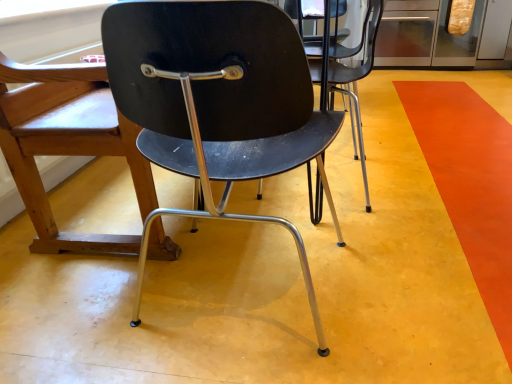
Question: Is orange matte floor at lower right situated inside matte black chair at center, which is the 1th chair in back-to-front order, or outside?

Choices:
 (A) outside
 (B) inside

Answer: (A)

Question: In the image, is orange matte floor at lower right positioned in front of or behind matte black chair at center, the 2th chair when ordered from front to back?

Choices:
 (A) front
 (B) behind

Answer: (A)

Question: Which object is the farthest from the orange matte floor at lower right?

Choices:
 (A) matte black chair at center, the 2th chair from the back
 (B) matte black chair at center, the 2th chair when ordered from front to back

Answer: (B)

Question: Estimate the real-world distances between objects in this image. Which object is closer to the matte black chair at center, the 2th chair when ordered from front to back?

Choices:
 (A) orange matte floor at lower right
 (B) matte black chair at center, the 2th chair from the back

Answer: (B)